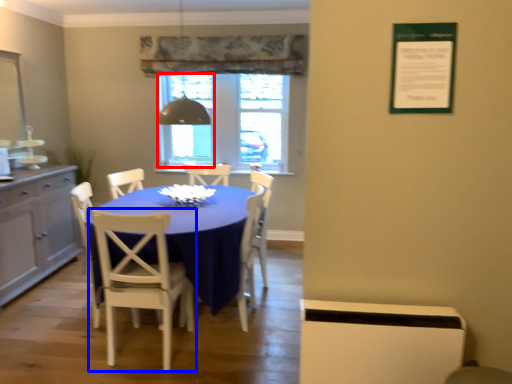
Question: Which object is further to the camera taking this photo, window screen (highlighted by a red box) or chair (highlighted by a blue box)?

Choices:
 (A) window screen
 (B) chair

Answer: (A)